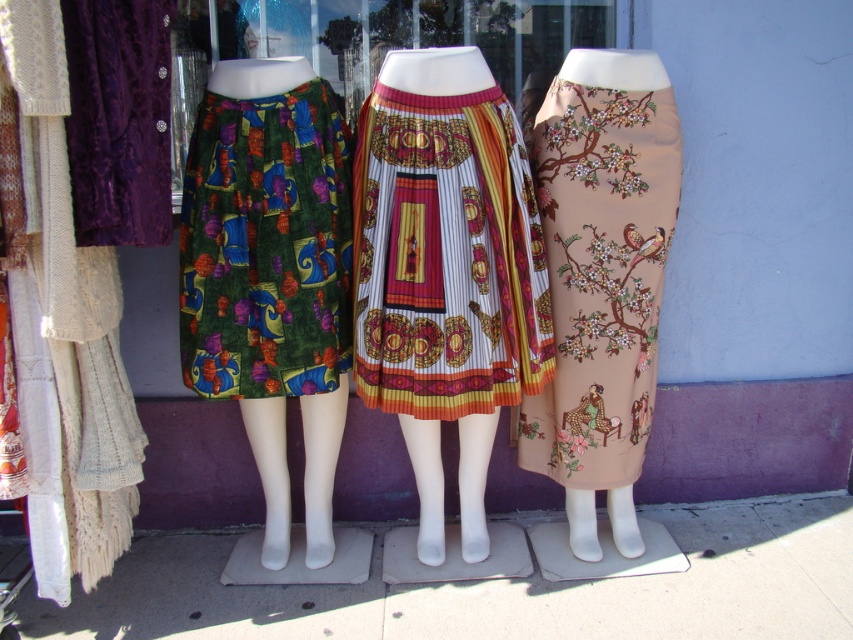
Question: Among these points, which one is farthest from the camera?

Choices:
 (A) click(x=296, y=134)
 (B) click(x=376, y=176)

Answer: (B)

Question: Is printed cotton skirt at center above beige floral skirt at center?

Choices:
 (A) yes
 (B) no

Answer: (B)

Question: Does beige floral skirt at center have a larger size compared to green velvet skirt at center?

Choices:
 (A) no
 (B) yes

Answer: (B)

Question: Which point is farther to the camera?

Choices:
 (A) (537, 438)
 (B) (463, 346)

Answer: (A)

Question: Which is nearer to the beige floral skirt at center?

Choices:
 (A) printed cotton skirt at center
 (B) green velvet skirt at center

Answer: (A)

Question: Is beige floral skirt at center to the right of green velvet skirt at center from the viewer's perspective?

Choices:
 (A) no
 (B) yes

Answer: (B)